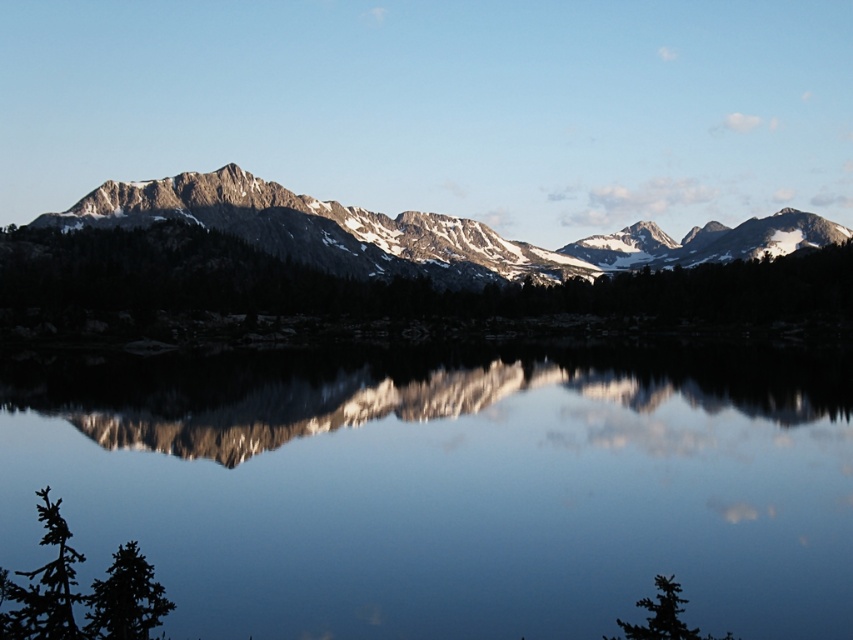
Looking at the serene mountain landscape, you notice the clear glass water at center and the snowy granite mountain range at center. Which of these two elements takes up more area in the image?

The snowy granite mountain range at center occupies more space than the clear glass water at center in the image.

You are standing at the edge of the lake in the mountain landscape. There is a point marked at coordinates point (447,486). What is located at this point?

The point (447,486) corresponds to clear glass water at center.